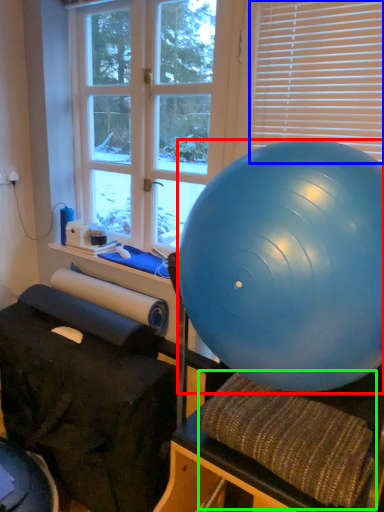
Question: Which object is the farthest from ball (highlighted by a red box)? Choose among these: blind (highlighted by a blue box) or bean bag chair (highlighted by a green box).

Choices:
 (A) blind
 (B) bean bag chair

Answer: (A)